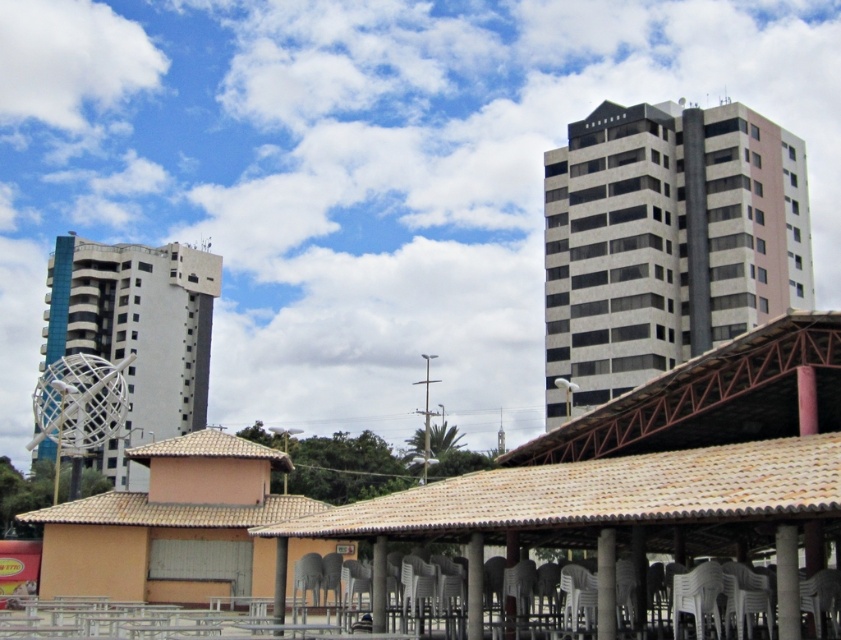
Consider the image. You are a photographer standing in the urban setting described. You want to capture a photo that includes both the white marble building at upper right and the white metallic sculpture at left. Based on their positions, which object should appear higher in the frame?

The white marble building at upper right should appear higher in the frame because it is located above the white metallic sculpture at left.

You are standing in the covered outdoor seating area and want to walk to the white marble building at upper right. If your walking speed is 1.5 meters per second, how long will it take you to reach the building?

The distance between you and the white marble building at upper right is 93.34 meters. At a walking speed of 1.5 meters per second, it would take approximately 62.23 seconds to reach the building.

You are standing in the urban scene and want to place a small flag at the point closer to you between point (146,554) and point (194,342). Which point should you choose?

You should choose point (146,554) because it is closer to the camera than point (194,342).